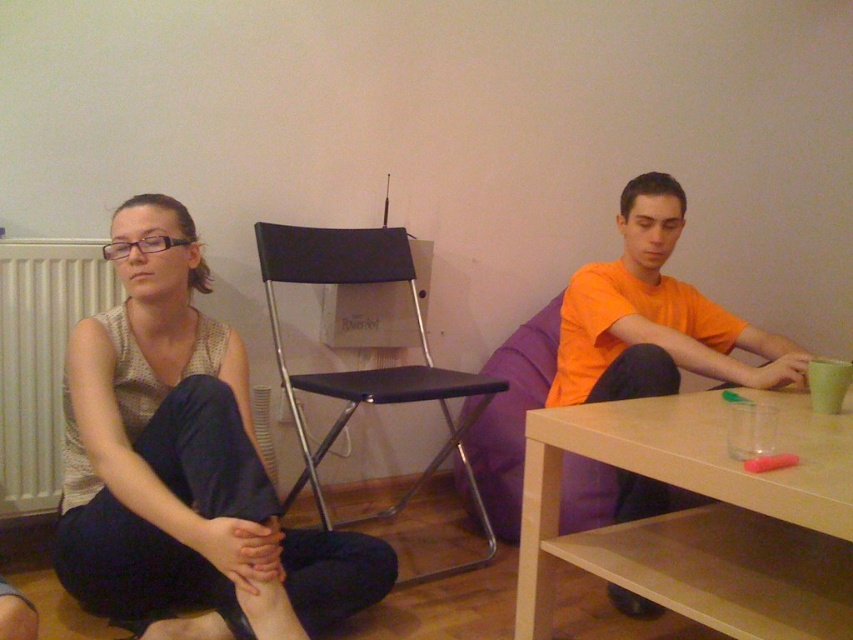
Question: Which point is closer to the camera taking this photo?

Choices:
 (A) (55, 304)
 (B) (706, 332)
 (C) (492, 401)
 (D) (727, 548)

Answer: (D)

Question: Which object is positioned farthest from the purple fabric couch at right?

Choices:
 (A) matte black chair at center
 (B) orange cotton shirt at right
 (C) white matte radiator at left
 (D) black matte chair at center

Answer: (C)

Question: Considering the relative positions of matte gray tank top at center and light brown wood table at lower right in the image provided, where is matte gray tank top at center located with respect to light brown wood table at lower right?

Choices:
 (A) below
 (B) above

Answer: (B)

Question: Is black matte chair at center above white matte radiator at left?

Choices:
 (A) yes
 (B) no

Answer: (B)

Question: Is matte black chair at center positioned in front of orange cotton shirt at right?

Choices:
 (A) yes
 (B) no

Answer: (B)

Question: Which object is closer to the camera taking this photo?

Choices:
 (A) black matte chair at center
 (B) white matte radiator at left
 (C) matte black chair at center

Answer: (C)